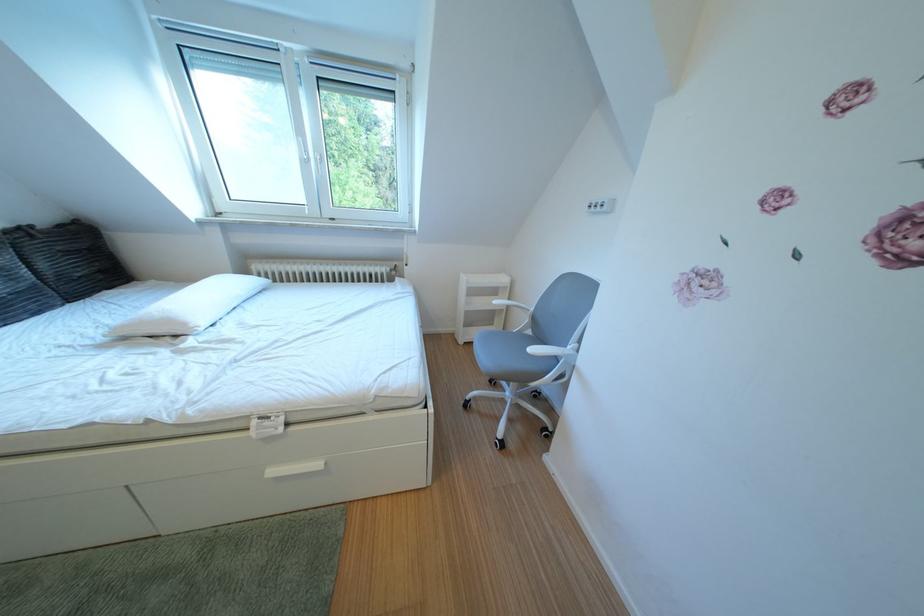
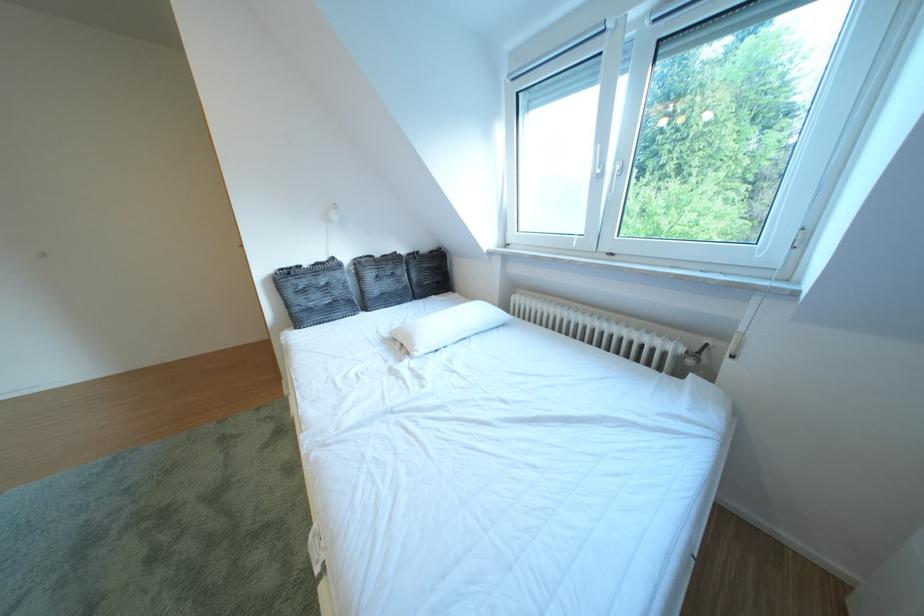
Question: How did the camera likely rotate?

Choices:
 (A) Left
 (B) Right
 (C) Up
 (D) Down

Answer: (A)